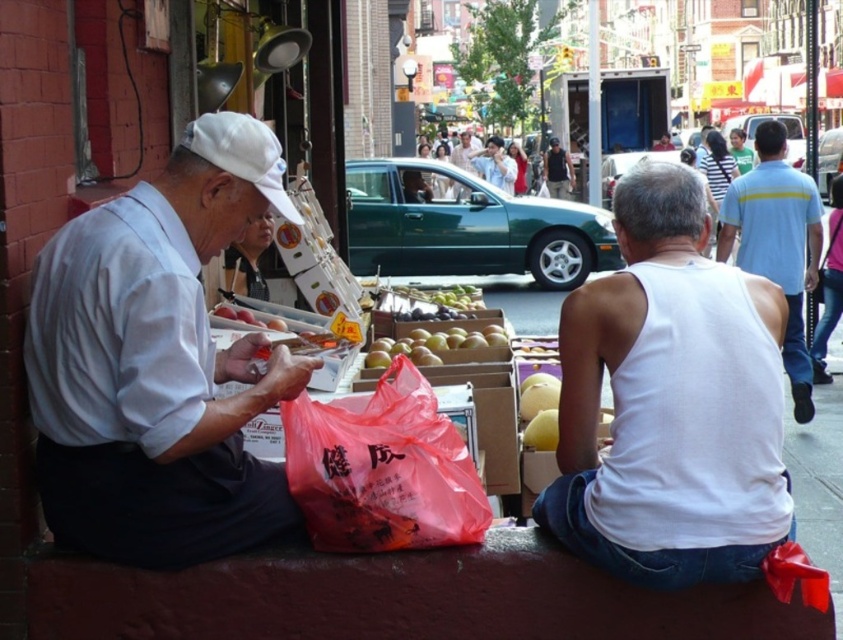
Question: Which object appears closest to the camera in this image?

Choices:
 (A) white matte shirt at left
 (B) white cotton tank top at center

Answer: (A)

Question: Is light blue striped shirt at right above yellow matte apples at center?

Choices:
 (A) yes
 (B) no

Answer: (A)

Question: Is light blue striped shirt at right thinner than dark blue jeans at center?

Choices:
 (A) no
 (B) yes

Answer: (A)

Question: Which point is closer to the camera?

Choices:
 (A) (229, 404)
 (B) (495, 337)
 (C) (486, 148)

Answer: (A)

Question: Which of the following is the closest to the observer?

Choices:
 (A) dark blue jeans at center
 (B) green cotton shirt at upper right
 (C) white matte shirt at left

Answer: (C)

Question: Does white cotton tank top at center appear over matte white shirt at center?

Choices:
 (A) yes
 (B) no

Answer: (B)